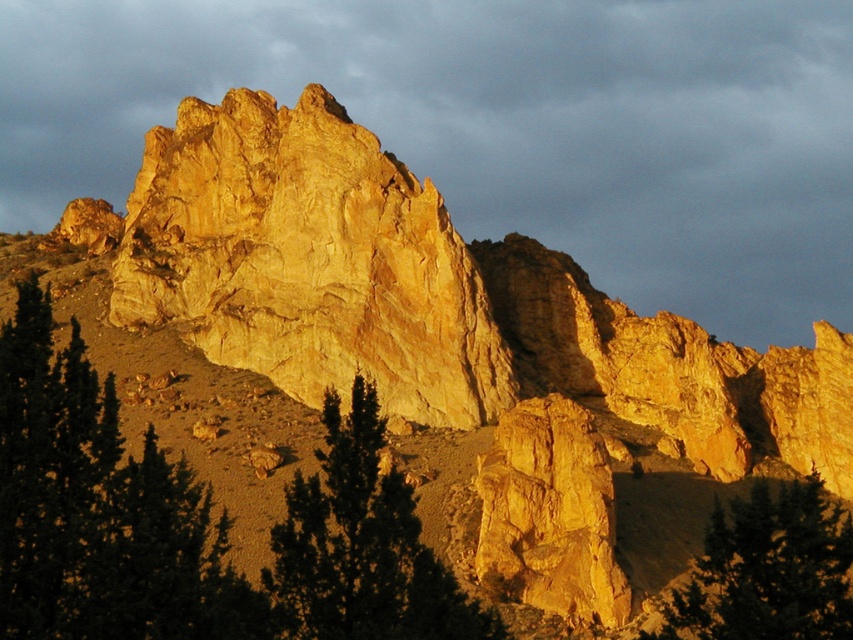
You are a hiker standing at the edge of the landscape. You see the yellow sandstone rock at center and the green matte tree at lower left. Which object is closer to you?

The yellow sandstone rock at center is closer to you because it is further to the viewer than the green matte tree at lower left.

You are a photographer planning to capture the yellow rock formation at upper center and the dark green textured tree at center in a single frame. Given their sizes, which object will appear bigger in the photo?

The yellow rock formation at upper center will appear bigger in the photo because it has a larger size compared to the dark green textured tree at center.